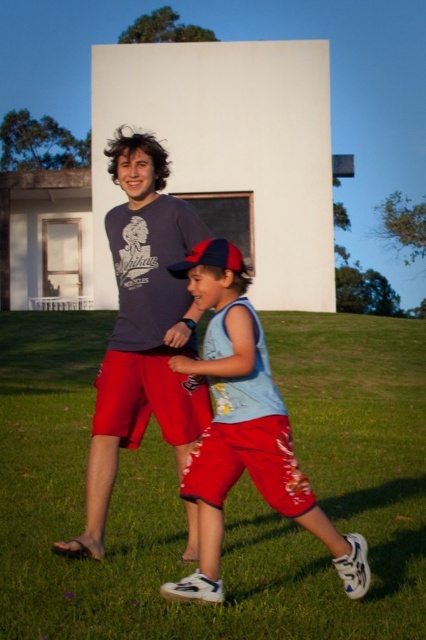
Does matte blue t-shirt at center have a greater width compared to red fabric baseball cap at center?

Yes, matte blue t-shirt at center is wider than red fabric baseball cap at center.

I want to click on matte blue t-shirt at center, so click(x=141, y=330).

Where is `matte blue t-shirt at center`? matte blue t-shirt at center is located at coordinates (141, 330).

Between point (226, 316) and point (178, 262), which one is positioned behind?

Point (178, 262)

Measure the distance between matte blue tank top at center and red fabric baseball cap at center.

matte blue tank top at center and red fabric baseball cap at center are 38.23 inches apart from each other.

Which is behind, point (299, 472) or point (227, 259)?

The point (227, 259) is behind.

What are the coordinates of `matte blue tank top at center` in the screenshot? It's located at (247, 440).

The image size is (426, 640). I want to click on green grass at center, so click(229, 493).

Which is behind, point (316, 328) or point (222, 244)?

Point (316, 328)

Between point (39, 612) and point (184, 276), which one is positioned in front?

Positioned in front is point (39, 612).

What are the coordinates of `green grass at center` in the screenshot? It's located at (229, 493).